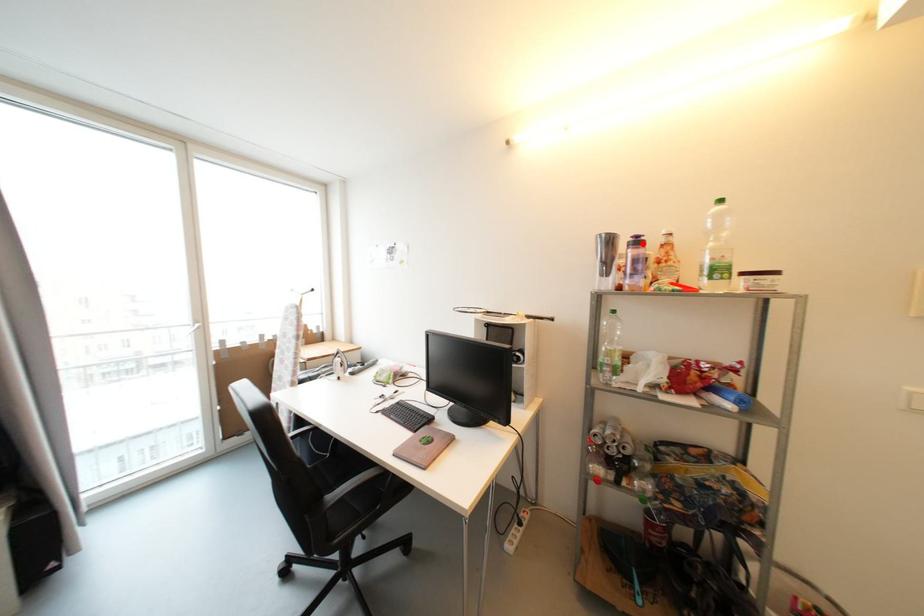
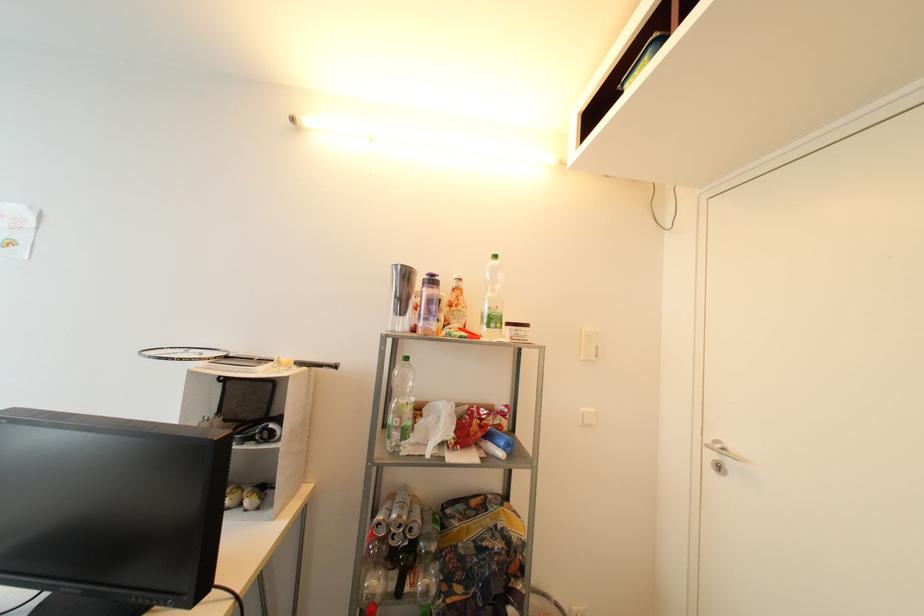
Locate, in the second image, the point that corresponds to the highlighted location in the first image.

(438, 283)